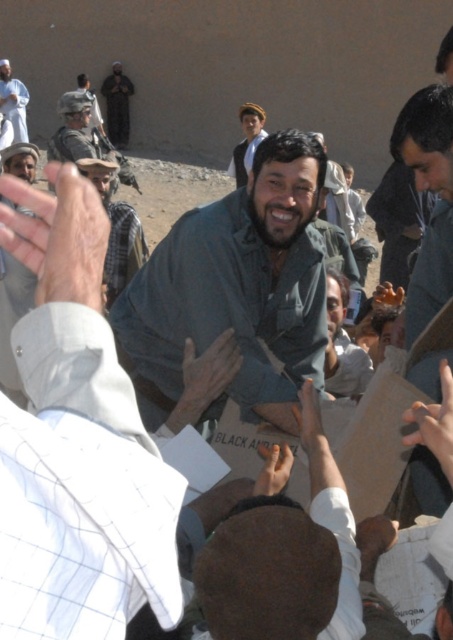
Is dark gray shirt at center shorter than brown felt hat at lower center?

Incorrect, dark gray shirt at center's height does not fall short of brown felt hat at lower center's.

Consider the image. Can you confirm if dark gray shirt at center is positioned to the left of brown felt hat at lower center?

Indeed, dark gray shirt at center is positioned on the left side of brown felt hat at lower center.

At what (x,y) coordinates should I click in order to perform the action: click on dark gray shirt at center. Please return your answer as a coordinate pair (x, y). This screenshot has height=640, width=453. Looking at the image, I should click on (236, 289).

What are the coordinates of `dark gray shirt at center` in the screenshot? It's located at (236, 289).

Does light brown fabric hat at upper center appear over white cotton shirt at upper left?

No.

Can you confirm if light brown fabric hat at upper center is taller than white cotton shirt at upper left?

Incorrect, light brown fabric hat at upper center's height is not larger of white cotton shirt at upper left's.

Which is behind, point (246, 115) or point (22, 116)?

Positioned behind is point (22, 116).

Where is `light brown fabric hat at upper center`? light brown fabric hat at upper center is located at coordinates [246, 141].

Between gray fabric shirt at center and light brown fabric hat at upper center, which one appears on the left side from the viewer's perspective?

From the viewer's perspective, gray fabric shirt at center appears more on the left side.

Between point (125, 237) and point (263, 129), which one is positioned behind?

Positioned behind is point (263, 129).

The image size is (453, 640). I want to click on gray fabric shirt at center, so click(x=115, y=228).